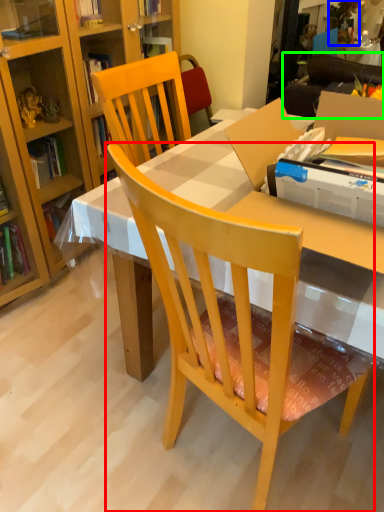
Question: Which object is positioned farthest from chair (highlighted by a red box)? Select from houseplant (highlighted by a blue box) and studio couch (highlighted by a green box).

Choices:
 (A) houseplant
 (B) studio couch

Answer: (A)